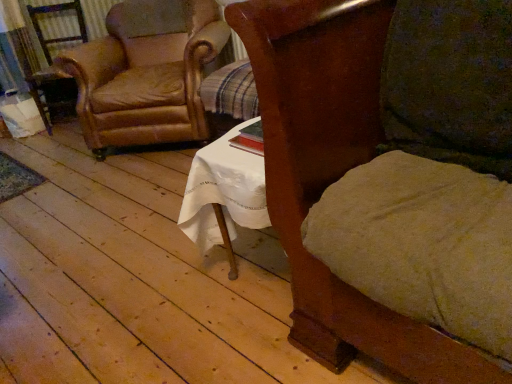
Question: Can you confirm if leather armchair at left is thinner than wooden chair at center, arranged as the first chair when viewed from the front?

Choices:
 (A) no
 (B) yes

Answer: (B)

Question: From a real-world perspective, is leather armchair at left over wooden chair at center, the 2th chair from the left?

Choices:
 (A) yes
 (B) no

Answer: (B)

Question: From a real-world perspective, is leather armchair at left below wooden chair at center, which appears as the second chair when viewed from the back?

Choices:
 (A) yes
 (B) no

Answer: (A)

Question: Does leather armchair at left have a greater width compared to wooden chair at center, arranged as the first chair when viewed from the front?

Choices:
 (A) yes
 (B) no

Answer: (B)

Question: Considering the relative positions of leather armchair at left and wooden chair at center, which appears as the second chair when viewed from the back, in the image provided, is leather armchair at left to the left of wooden chair at center, which appears as the second chair when viewed from the back, from the viewer's perspective?

Choices:
 (A) yes
 (B) no

Answer: (A)

Question: From a real-world perspective, is wooden chair at center, the 2th chair from the left, above or below leather armchair at left?

Choices:
 (A) above
 (B) below

Answer: (A)

Question: Considering the positions of wooden chair at center, the 2th chair from the left, and leather armchair at left in the image, is wooden chair at center, the 2th chair from the left, taller or shorter than leather armchair at left?

Choices:
 (A) tall
 (B) short

Answer: (A)

Question: From the image's perspective, is wooden chair at center, which appears as the second chair when viewed from the back, located above or below leather armchair at left?

Choices:
 (A) below
 (B) above

Answer: (A)

Question: Based on their sizes in the image, would you say wooden chair at center, which appears as the second chair when viewed from the back, is bigger or smaller than leather armchair at left?

Choices:
 (A) big
 (B) small

Answer: (A)

Question: Do you think leather armchair at left is within wooden chair at center, which is the first chair in right-to-left order, or outside of it?

Choices:
 (A) inside
 (B) outside

Answer: (B)

Question: Considering their positions, is leather armchair at left located in front of or behind wooden chair at center, arranged as the first chair when viewed from the front?

Choices:
 (A) behind
 (B) front

Answer: (A)

Question: From their relative heights in the image, would you say leather armchair at left is taller or shorter than wooden chair at center, which is the first chair in right-to-left order?

Choices:
 (A) short
 (B) tall

Answer: (A)

Question: From a real-world perspective, is leather armchair at left positioned above or below wooden chair at center, arranged as the first chair when viewed from the front?

Choices:
 (A) below
 (B) above

Answer: (A)

Question: Considering the positions of wooden chair at center, which appears as the second chair when viewed from the back, and leather at left, arranged as the first chair when viewed from the back, in the image, is wooden chair at center, which appears as the second chair when viewed from the back, wider or thinner than leather at left, arranged as the first chair when viewed from the back,?

Choices:
 (A) thin
 (B) wide

Answer: (A)

Question: Is wooden chair at center, the 2th chair from the left, in front of or behind leather at left, arranged as the first chair when viewed from the back, in the image?

Choices:
 (A) front
 (B) behind

Answer: (A)